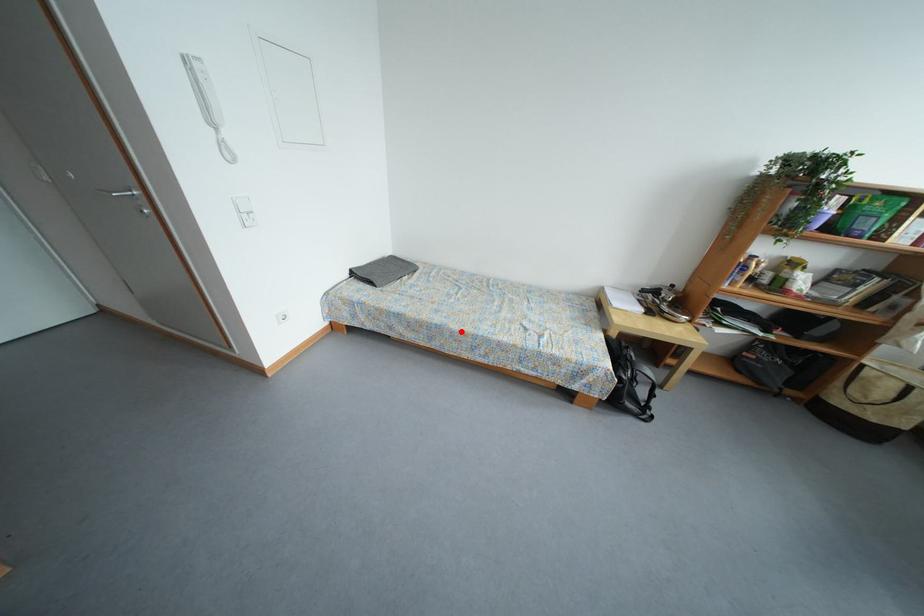
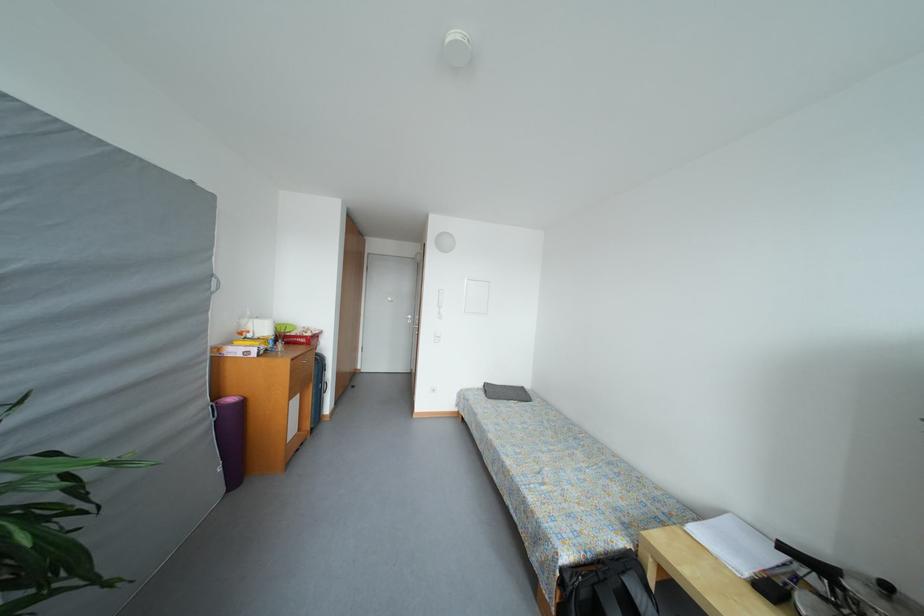
In the second image, find the point that corresponds to the highlighted location in the first image.

(496, 440)